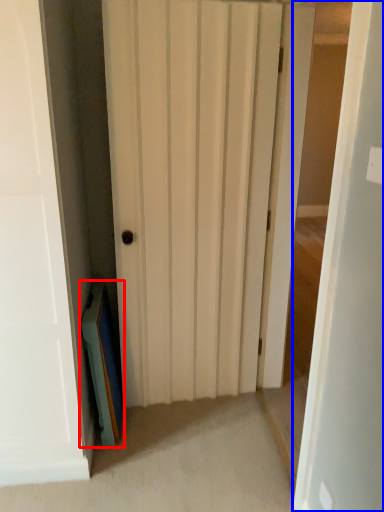
Question: Among these objects, which one is farthest to the camera, book (highlighted by a red box) or door (highlighted by a blue box)?

Choices:
 (A) book
 (B) door

Answer: (A)